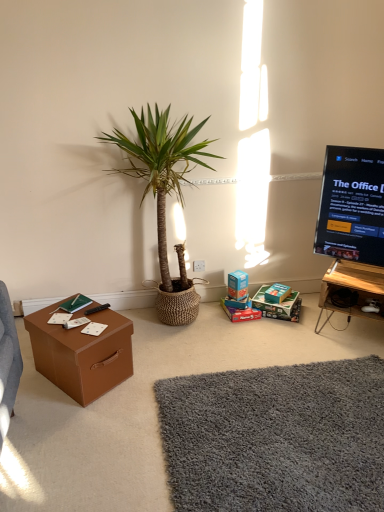
I want to click on vacant space in between green woven pot at center and shaggy gray rug at lower center, which is the first plain in back-to-front order, so click(214, 350).